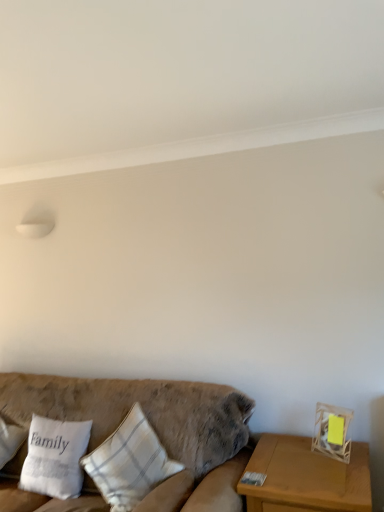
Question: Does white cotton pillow at left, the third pillow viewed from the left, lie behind white fabric pillow at lower left, the second pillow when ordered from right to left?

Choices:
 (A) no
 (B) yes

Answer: (A)

Question: Can you confirm if white cotton pillow at left, the third pillow viewed from the left, is wider than white fabric pillow at lower left, the second pillow when ordered from right to left?

Choices:
 (A) yes
 (B) no

Answer: (A)

Question: From a real-world perspective, is white cotton pillow at left, the third pillow viewed from the left, physically above white fabric pillow at lower left, the second pillow when ordered from right to left?

Choices:
 (A) yes
 (B) no

Answer: (A)

Question: From the image's perspective, is white cotton pillow at left, the third pillow viewed from the left, below white fabric pillow at lower left, placed as the 2th pillow when sorted from left to right?

Choices:
 (A) yes
 (B) no

Answer: (B)

Question: Is white cotton pillow at left, which ranks as the 1th pillow in right-to-left order, with white fabric pillow at lower left, the second pillow when ordered from right to left?

Choices:
 (A) yes
 (B) no

Answer: (B)

Question: From the image's perspective, is white cotton pillow at left, which ranks as the 1th pillow in right-to-left order, above white fabric pillow at lower left, placed as the 2th pillow when sorted from left to right?

Choices:
 (A) no
 (B) yes

Answer: (B)

Question: Can you confirm if velvet beige couch at lower left is wider than wooden table at right?

Choices:
 (A) no
 (B) yes

Answer: (B)

Question: Is velvet beige couch at lower left positioned beyond the bounds of wooden table at right?

Choices:
 (A) yes
 (B) no

Answer: (A)

Question: Is wooden table at right completely or partially inside velvet beige couch at lower left?

Choices:
 (A) yes
 (B) no

Answer: (B)

Question: Does velvet beige couch at lower left have a lesser width compared to wooden table at right?

Choices:
 (A) yes
 (B) no

Answer: (B)

Question: Can you confirm if velvet beige couch at lower left is taller than wooden table at right?

Choices:
 (A) no
 (B) yes

Answer: (B)

Question: From a real-world perspective, is velvet beige couch at lower left on top of wooden table at right?

Choices:
 (A) yes
 (B) no

Answer: (A)

Question: Does white fabric pillow at lower left, the second pillow when ordered from right to left, come behind white fabric pillow at left, positioned as the 3th pillow in right-to-left order?

Choices:
 (A) yes
 (B) no

Answer: (B)